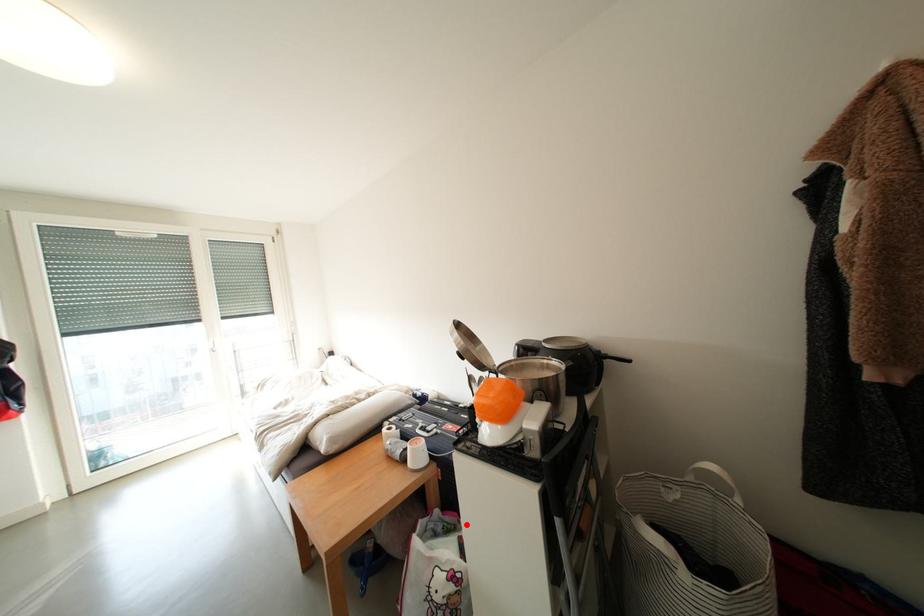
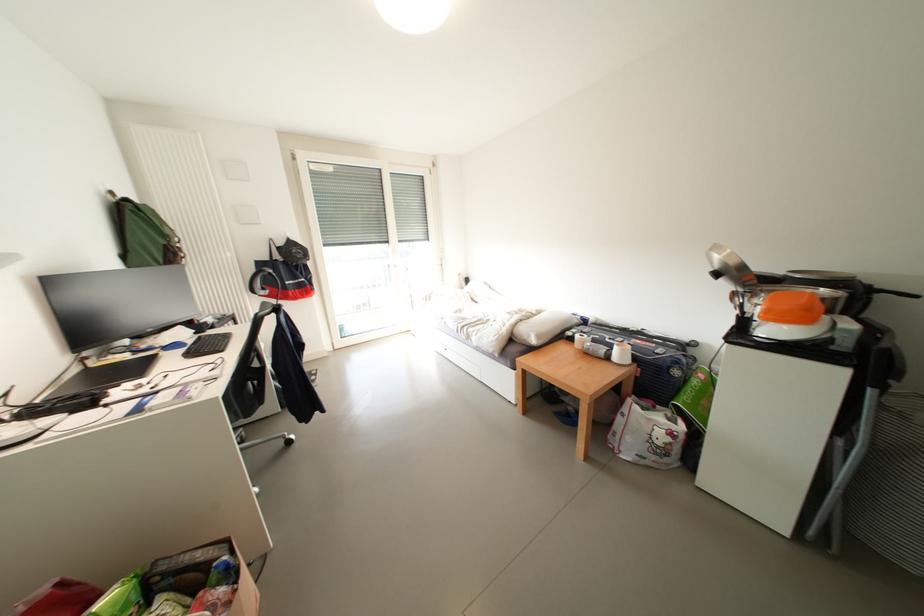
In the second image, find the point that corresponds to the highlighted location in the first image.

(662, 410)